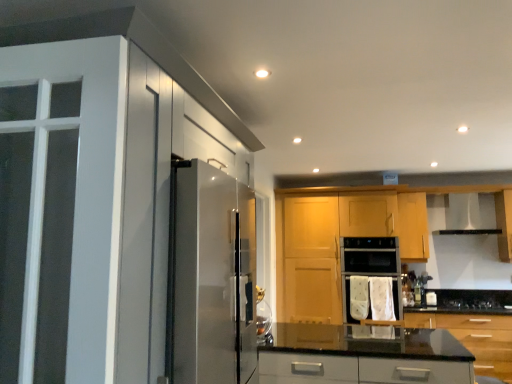
Identify the location of glossy wood cabinets at center, the 3th cabinetry from the right. (362, 355).

The image size is (512, 384). What do you see at coordinates (475, 301) in the screenshot?
I see `black glass gas stove at lower center` at bounding box center [475, 301].

How much space does white glossy cabinet at left, acting as the fourth cabinetry starting from the right, occupy vertically?

white glossy cabinet at left, acting as the fourth cabinetry starting from the right, is 1.56 meters tall.

Locate an element on the screen. The height and width of the screenshot is (384, 512). satin silver screen door at left is located at coordinates (245, 282).

From the picture: What is the approximate height of satin silver screen door at left?

satin silver screen door at left is 4.95 feet tall.

The image size is (512, 384). Identify the location of glossy wood cabinets at center, which is the second cabinetry in left-to-right order. (362, 355).

Is white fabric oven at center outside of white glossy cabinet at left, positioned as the 1th cabinetry in left-to-right order?

That's correct, white fabric oven at center is outside of white glossy cabinet at left, positioned as the 1th cabinetry in left-to-right order.

Consider the image. Considering their positions, is white fabric oven at center located in front of or behind white glossy cabinet at left, acting as the fourth cabinetry starting from the right?

Clearly, white fabric oven at center is behind white glossy cabinet at left, acting as the fourth cabinetry starting from the right.

Which of these two, white fabric oven at center or white glossy cabinet at left, positioned as the 1th cabinetry in left-to-right order, stands taller?

With more height is white glossy cabinet at left, positioned as the 1th cabinetry in left-to-right order.

Based on the photo, who is smaller, white fabric oven at center or white glossy cabinet at left, positioned as the 1th cabinetry in left-to-right order?

Smaller between the two is white fabric oven at center.

Considering the positions of points (505, 212) and (384, 262), is point (505, 212) closer to camera compared to point (384, 262)?

That is False.

From a real-world perspective, does wooden cabinet at center, which ranks as the third cabinetry in left-to-right order, sit lower than white fabric oven at center?

No.

Does wooden cabinet at center, which appears as the second cabinetry when viewed from the right, touch white fabric oven at center?

wooden cabinet at center, which appears as the second cabinetry when viewed from the right, and white fabric oven at center are not in contact.

Considering the relative sizes of black glass gas stove at lower center and white fabric oven at center in the image provided, is black glass gas stove at lower center bigger than white fabric oven at center?

No.

Looking at this image, from a real-world perspective, is black glass gas stove at lower center physically located above or below white fabric oven at center?

black glass gas stove at lower center is below white fabric oven at center.

From the image's perspective, is black glass gas stove at lower center located above or below white fabric oven at center?

Based on their image positions, black glass gas stove at lower center is located beneath white fabric oven at center.

Considering the positions of objects black glass gas stove at lower center and white fabric oven at center in the image provided, who is behind, black glass gas stove at lower center or white fabric oven at center?

Positioned behind is white fabric oven at center.

Is point (250, 308) positioned before point (507, 303)?

Yes, point (250, 308) is in front of point (507, 303).

Is satin silver screen door at left to the right of black glass gas stove at lower center from the viewer's perspective?

No.

Is satin silver screen door at left far from black glass gas stove at lower center?

satin silver screen door at left is positioned a significant distance from black glass gas stove at lower center.

Does satin silver screen door at left come in front of black glass gas stove at lower center?

Yes, satin silver screen door at left is closer to the camera.

Measure the distance from satin silver screen door at left to satin silver exhaust hood at upper right.

satin silver screen door at left is 3.06 meters from satin silver exhaust hood at upper right.

From a real-world perspective, is satin silver screen door at left positioned under satin silver exhaust hood at upper right based on gravity?

Yes.

From the image's perspective, which is below, satin silver screen door at left or satin silver exhaust hood at upper right?

satin silver screen door at left is shown below in the image.

Does satin silver screen door at left have a greater height compared to satin silver exhaust hood at upper right?

Yes.

Would you say black glossy countertop at lower right, the 1th cabinetry positioned from the right, contains black glass gas stove at lower center?

Yes, black glass gas stove at lower center is surrounded by black glossy countertop at lower right, the 1th cabinetry positioned from the right.

Looking at this image, is black glossy countertop at lower right, which is the 4th cabinetry from left to right, with black glass gas stove at lower center?

No, black glossy countertop at lower right, which is the 4th cabinetry from left to right, is not with black glass gas stove at lower center.

Is black glossy countertop at lower right, which is the 4th cabinetry from left to right, turned away from black glass gas stove at lower center?

Yes, black glossy countertop at lower right, which is the 4th cabinetry from left to right,'s orientation is away from black glass gas stove at lower center.

Considering the positions of points (474, 328) and (456, 303), is point (474, 328) farther from camera compared to point (456, 303)?

No.

Between white fabric oven at center and glossy wood cabinets at center, which is the second cabinetry in left-to-right order, which one has smaller width?

white fabric oven at center.

How different are the orientations of white fabric oven at center and glossy wood cabinets at center, the 3th cabinetry from the right, in degrees?

white fabric oven at center and glossy wood cabinets at center, the 3th cabinetry from the right, are facing 0.891 degrees away from each other.

Is white fabric oven at center placed right next to glossy wood cabinets at center, which is the second cabinetry in left-to-right order?

white fabric oven at center and glossy wood cabinets at center, which is the second cabinetry in left-to-right order, are clearly separated.

Locate an element on the screen. The height and width of the screenshot is (384, 512). cabinetry that is the 2nd object above the white fabric oven at center (from a real-world perspective) is located at coordinates (83, 213).

The image size is (512, 384). What are the coordinates of `the 1st cabinetry above the white fabric oven at center (from the image's perspective)` in the screenshot? It's located at (353, 236).

Based on the photo, which object lies further to the anchor point white fabric oven at center, glossy wood cabinets at center, which is the second cabinetry in left-to-right order, or black glass gas stove at lower center?

The object further to white fabric oven at center is black glass gas stove at lower center.

Estimate the real-world distances between objects in this image. Which object is closer to satin silver exhaust hood at upper right, white glossy cabinet at left, positioned as the 1th cabinetry in left-to-right order, or satin silver screen door at left?

satin silver screen door at left is positioned closer to the anchor satin silver exhaust hood at upper right.

When comparing their distances from white fabric oven at center, does glossy wood cabinets at center, the 3th cabinetry from the right, or white glossy cabinet at left, acting as the fourth cabinetry starting from the right, seem closer?

Among the two, glossy wood cabinets at center, the 3th cabinetry from the right, is located nearer to white fabric oven at center.

Considering their positions, is black glossy countertop at lower right, which is the 4th cabinetry from left to right, positioned further to white fabric oven at center than white glossy cabinet at left, positioned as the 1th cabinetry in left-to-right order?

The object further to white fabric oven at center is white glossy cabinet at left, positioned as the 1th cabinetry in left-to-right order.

When comparing their distances from glossy wood cabinets at center, the 3th cabinetry from the right, does black glass gas stove at lower center or black glossy countertop at lower right, which is the 4th cabinetry from left to right, seem further?

black glass gas stove at lower center is further to glossy wood cabinets at center, the 3th cabinetry from the right.

Estimate the real-world distances between objects in this image. Which object is further from wooden cabinet at center, which ranks as the third cabinetry in left-to-right order, satin silver screen door at left or black glossy countertop at lower right, which is the 4th cabinetry from left to right?

Based on the image, satin silver screen door at left appears to be further to wooden cabinet at center, which ranks as the third cabinetry in left-to-right order.

Which object lies further to the anchor point black glass gas stove at lower center, black glossy countertop at lower right, which is the 4th cabinetry from left to right, or white glossy cabinet at left, acting as the fourth cabinetry starting from the right?

Based on the image, white glossy cabinet at left, acting as the fourth cabinetry starting from the right, appears to be further to black glass gas stove at lower center.

From the image, which object appears to be nearer to wooden cabinet at center, which ranks as the third cabinetry in left-to-right order, satin silver exhaust hood at upper right or black glossy countertop at lower right, which is the 4th cabinetry from left to right?

satin silver exhaust hood at upper right lies closer to wooden cabinet at center, which ranks as the third cabinetry in left-to-right order, than the other object.

At what (x,y) coordinates should I click in order to perform the action: click on screen door between white glossy cabinet at left, positioned as the 1th cabinetry in left-to-right order, and white fabric oven at center from front to back. Please return your answer as a coordinate pair (x, y). Looking at the image, I should click on (245, 282).

I want to click on oven between satin silver screen door at left and black glass gas stove at lower center, so click(x=371, y=279).

Locate an element on the screen. oven located between satin silver screen door at left and satin silver exhaust hood at upper right in the left-right direction is located at coordinates (371, 279).

The width and height of the screenshot is (512, 384). Identify the location of gas stove positioned between glossy wood cabinets at center, which is the second cabinetry in left-to-right order, and satin silver exhaust hood at upper right from near to far. (475, 301).